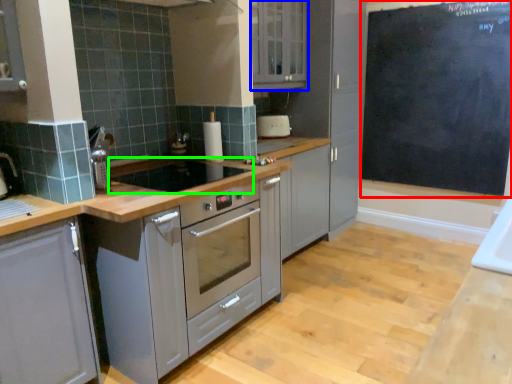
Question: Which is nearer to the bulletin board (highlighted by a red box)? cabinetry (highlighted by a blue box) or gas stove (highlighted by a green box).

Choices:
 (A) cabinetry
 (B) gas stove

Answer: (A)